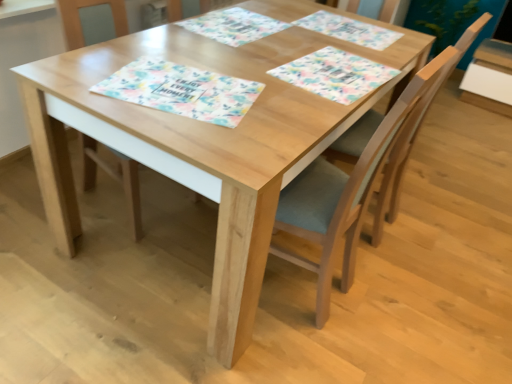
You are a GUI agent. You are given a task and a screenshot of the screen. Output one action in this format:
    pyautogui.click(x=<x>, y=<y>)
    Task: Click on the free spot below floral paper placemat at center, which is the 4th place mat in back-to-front order (from a real-world perspective)
    This screenshot has height=384, width=512.
    Given the screenshot: What is the action you would take?
    pyautogui.click(x=184, y=89)